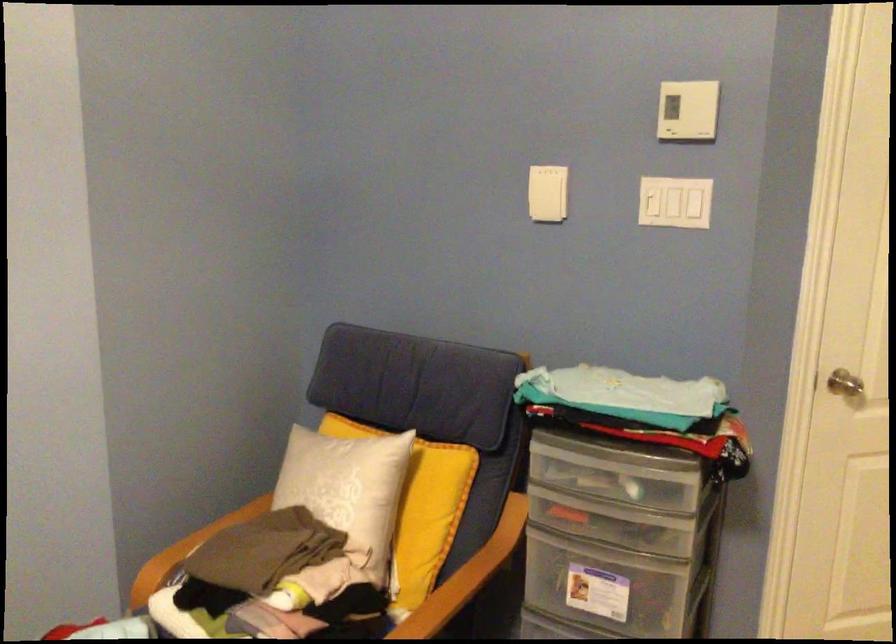
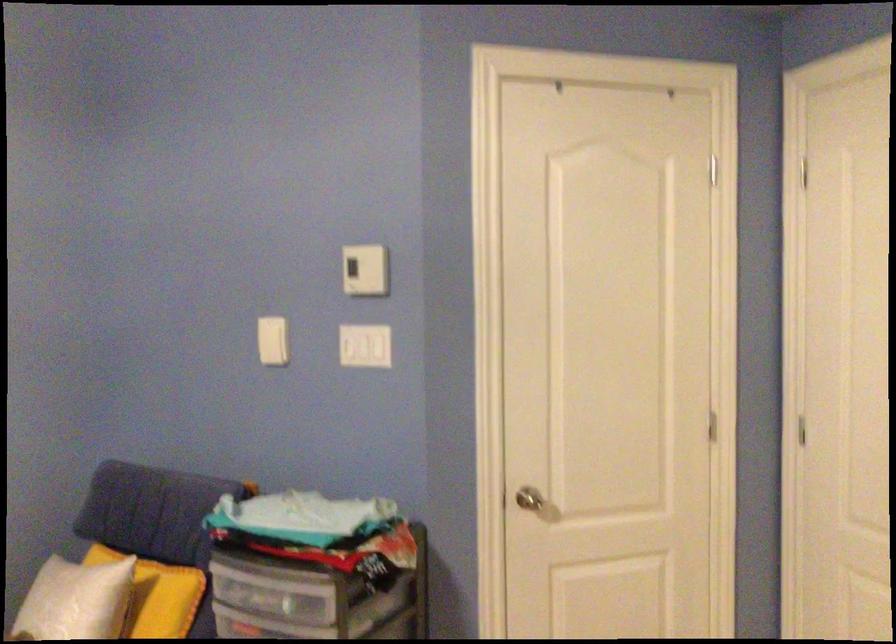
Where in the second image is the point corresponding to (x=681, y=201) from the first image?

(365, 346)